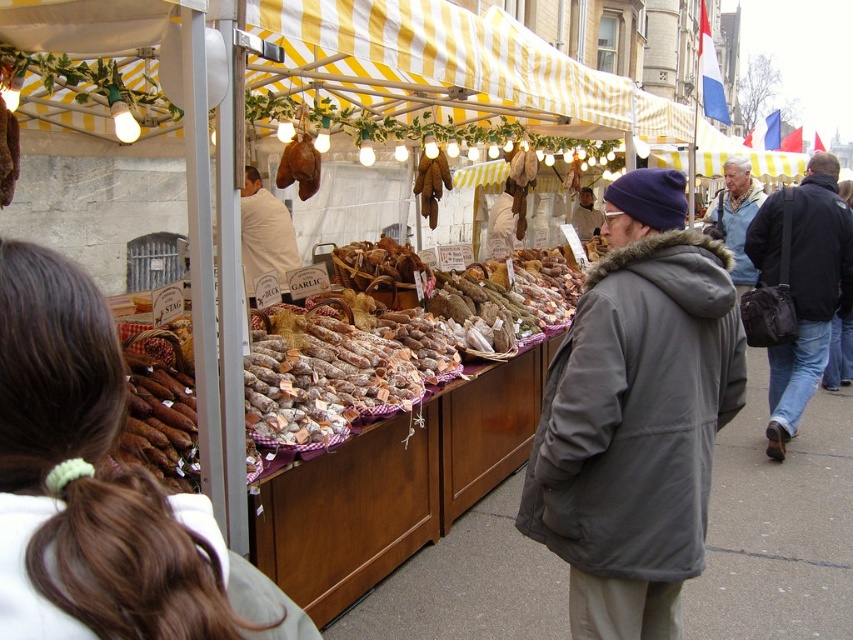
You are a customer at the market and want to reach the stall. You are currently standing at point (776, 456). There is an obstacle at point (654, 541). Can you walk straight ahead to the stall without going around the obstacle?

Point (654, 541) is in front of point (776, 456), so the obstacle is directly in your path. You will need to go around it to reach the stall.

You are a customer at the market and want to place your black leather bag at right next to the gray wool coat at center. Can you fit both items side by side on the shelf without overlapping?

The gray wool coat at center is narrower than the black leather bag at right. However, since the question does not provide information about the total shelf width or the individual dimensions of both items, it is impossible to determine if they can fit side by side without overlapping. Additional measurements are needed to make this assessment.